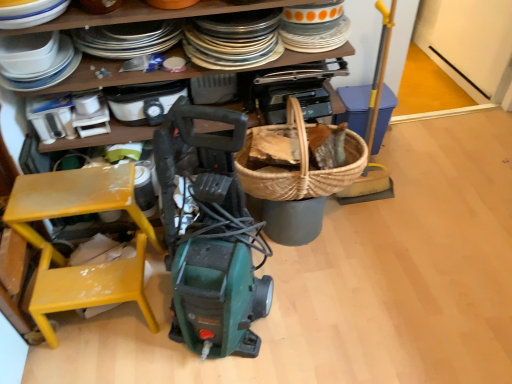
You are a GUI agent. You are given a task and a screenshot of the screen. Output one action in this format:
    pyautogui.click(x=<x>, y=<y>)
    Task: Click on the vacant region to the right of woven basket at right, which is the first appliance in right-to-left order
    
    Given the screenshot: What is the action you would take?
    pyautogui.click(x=404, y=155)